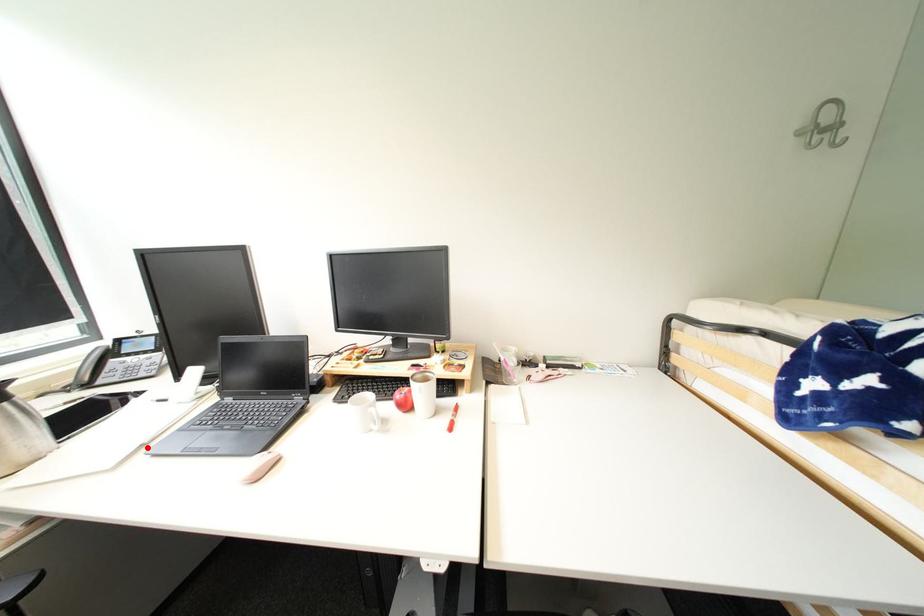
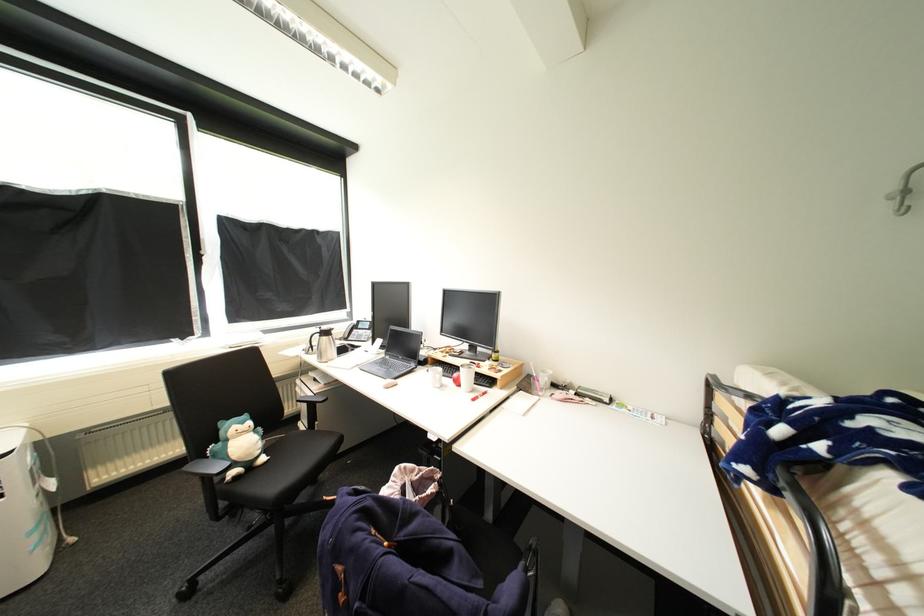
Question: I am providing you with two images of the same scene from different viewpoints. A red point is marked on the first image. At the location where the point appears in image 1, is it still visible in image 2?

Choices:
 (A) Yes
 (B) No

Answer: (A)